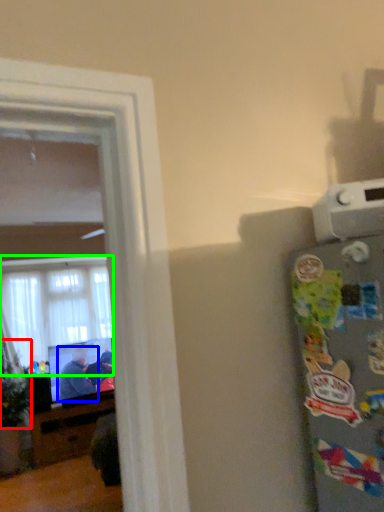
Question: Considering the real-world distances, which object is farthest from plant (highlighted by a red box)? person (highlighted by a blue box) or window (highlighted by a green box)?

Choices:
 (A) person
 (B) window

Answer: (B)